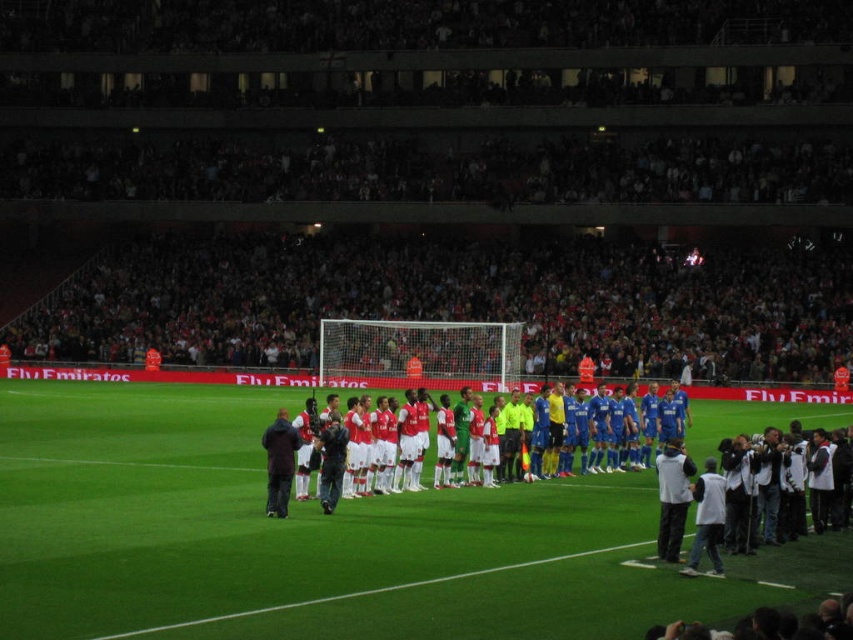
Question: Is dark red fabric crowd at upper center to the left of white smooth soccer team at center from the viewer's perspective?

Choices:
 (A) yes
 (B) no

Answer: (A)

Question: Among these objects, which one is nearest to the camera?

Choices:
 (A) white smooth soccer team at center
 (B) white fabric jacket at center

Answer: (B)

Question: Which of the following is the farthest from the observer?

Choices:
 (A) green artificial turf at center
 (B) white smooth soccer team at center
 (C) dark red fabric crowd at upper center
 (D) dark blue jacket at center

Answer: (C)

Question: From the image, what is the correct spatial relationship of white smooth soccer team at center in relation to dark blue jacket at center?

Choices:
 (A) above
 (B) below

Answer: (B)

Question: Does green artificial turf at center appear under white fabric jacket at center?

Choices:
 (A) no
 (B) yes

Answer: (B)

Question: Which object is farther from the camera taking this photo?

Choices:
 (A) green artificial turf at center
 (B) white fabric jacket at center

Answer: (B)